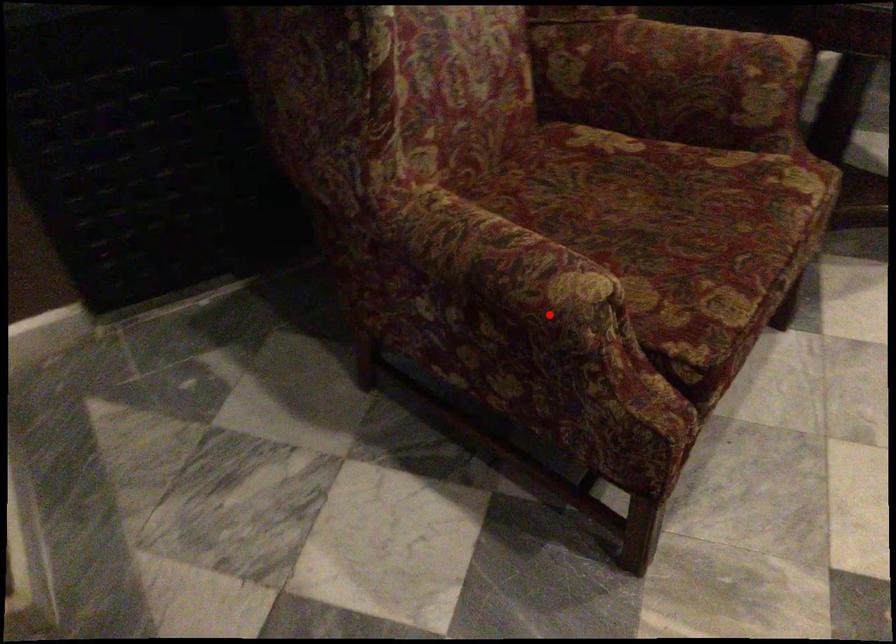
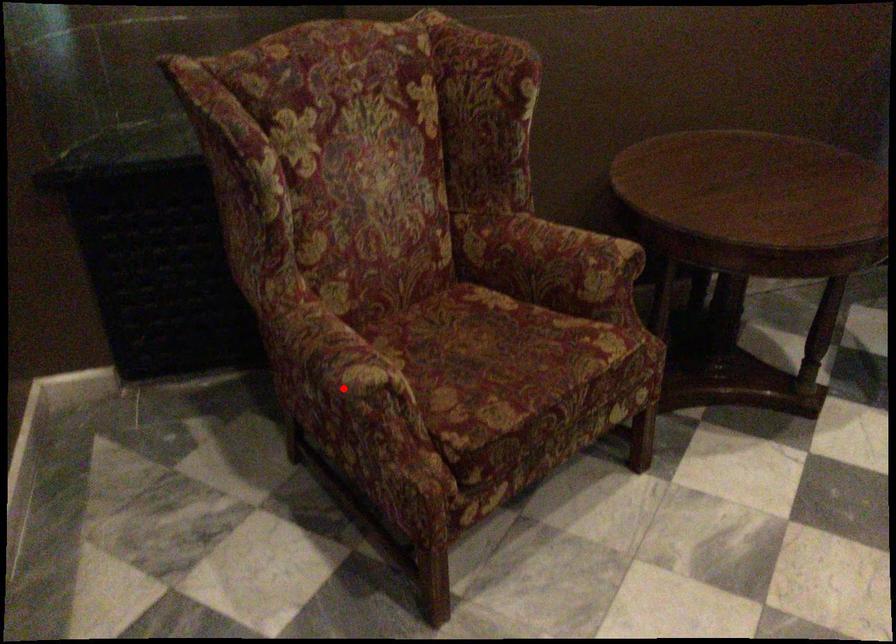
I am providing you with two images of the same scene from different viewpoints. A red point is marked on the first image and another point is marked on the second image. Do the highlighted points in image1 and image2 indicate the same real-world spot?

Yes